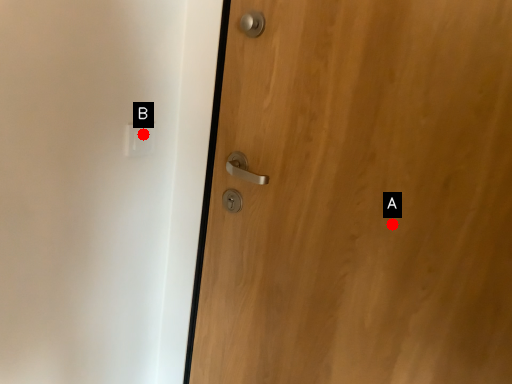
Question: Two points are circled on the image, labeled by A and B beside each circle. Which point is closer to the camera?

Choices:
 (A) A is closer
 (B) B is closer

Answer: (A)